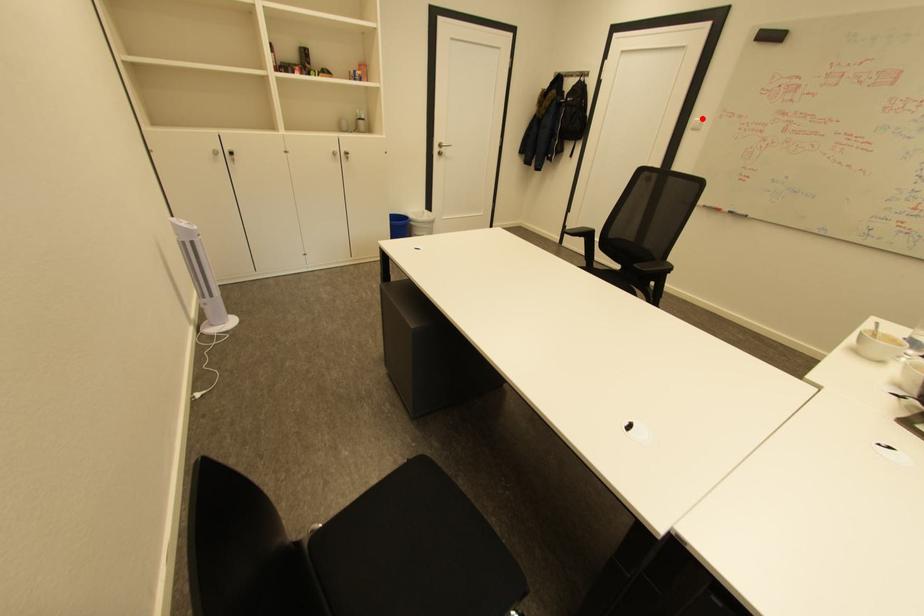
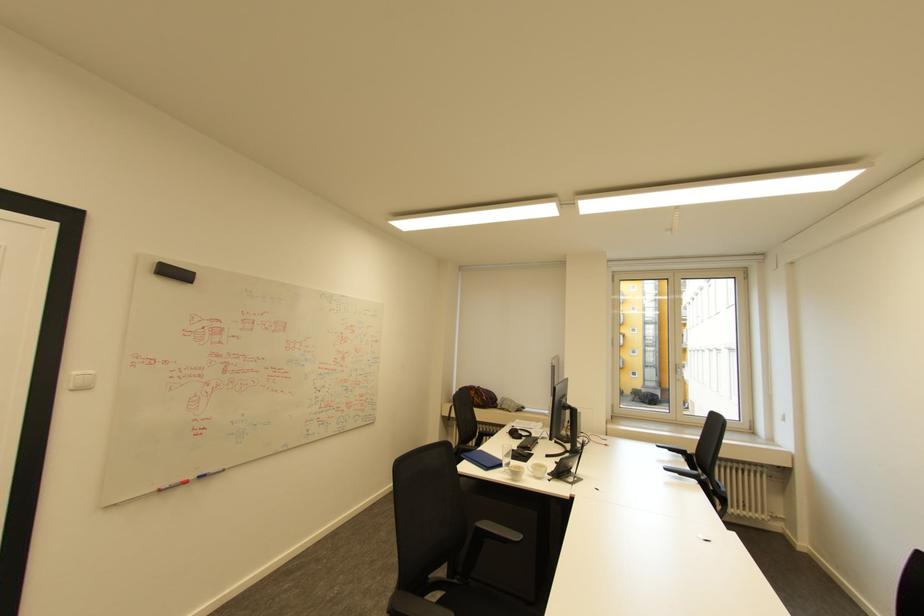
The point at the highlighted location is marked in the first image. Where is the corresponding point in the second image?

(79, 371)